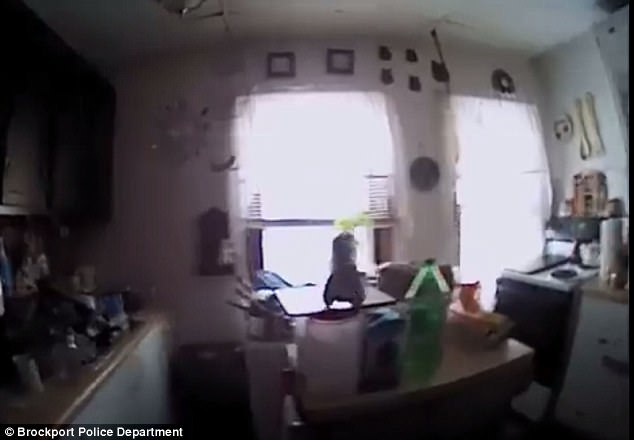
Where is `places to sit`? This screenshot has height=440, width=634. places to sit is located at coordinates (529, 382), (392, 294).